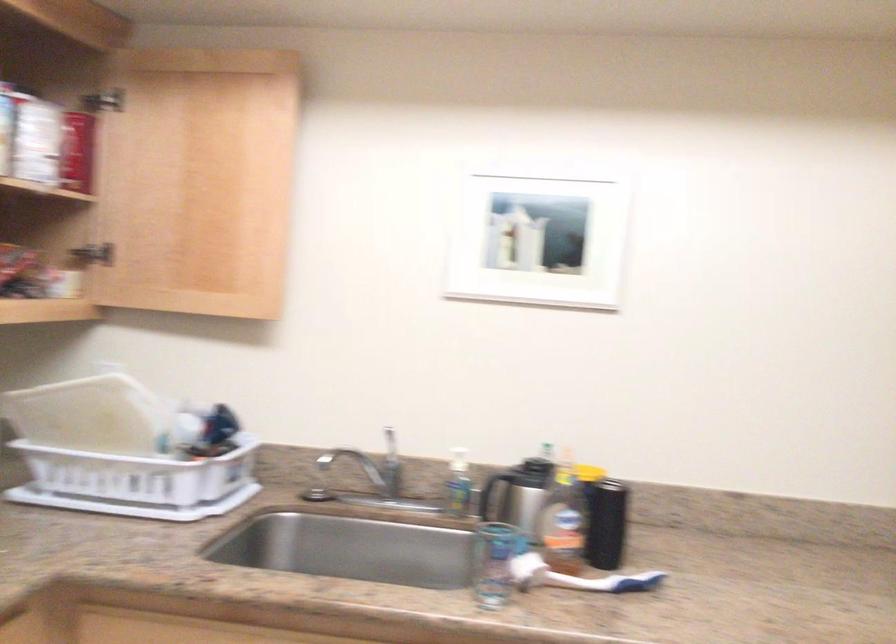
The images are taken continuously from a first-person perspective. In which direction is your viewpoint rotating?

The camera rotated toward left-down.